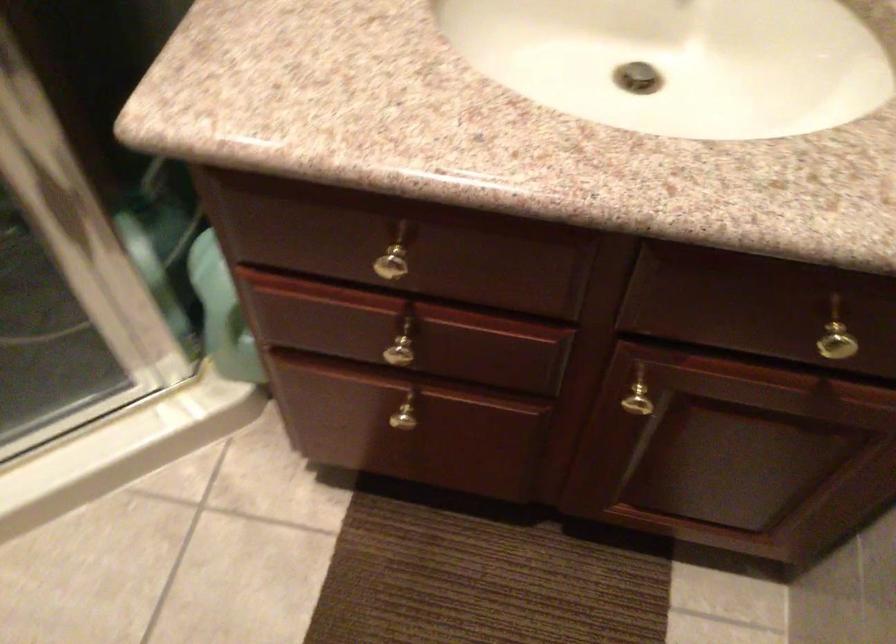
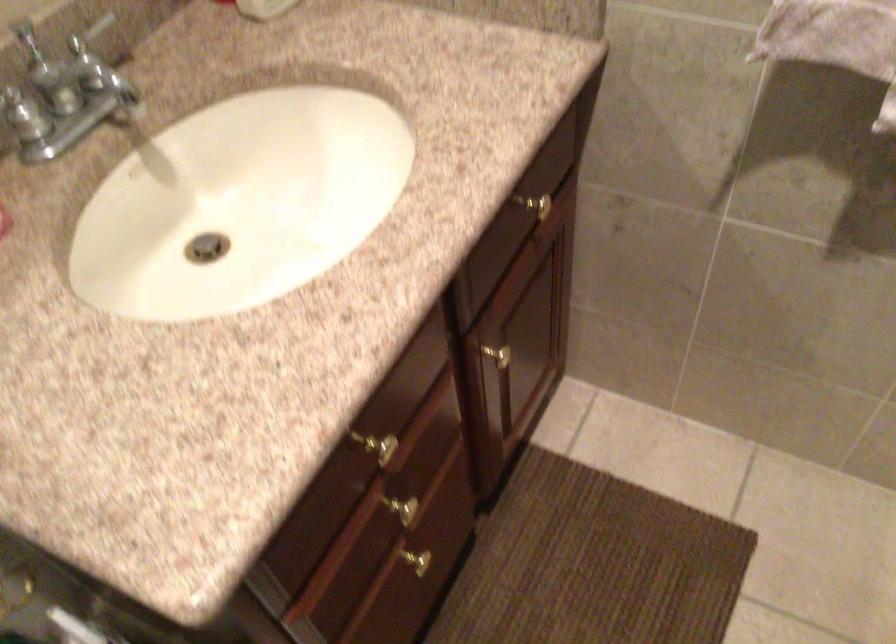
The first image is from the beginning of the video and the second image is from the end. How did the camera likely rotate when shooting the video?

The rotation direction of the camera is right-down.